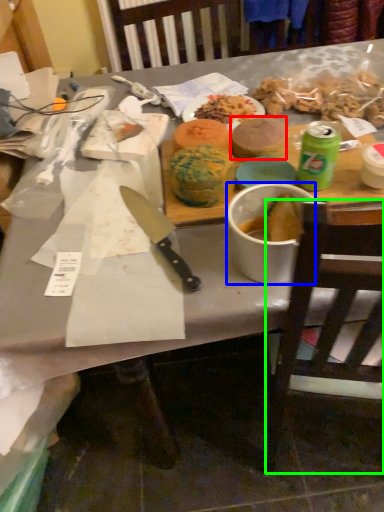
Question: Based on their relative distances, which object is nearer to food (highlighted by a red box)? Choose from bowl (highlighted by a blue box) and chair (highlighted by a green box).

Choices:
 (A) bowl
 (B) chair

Answer: (A)